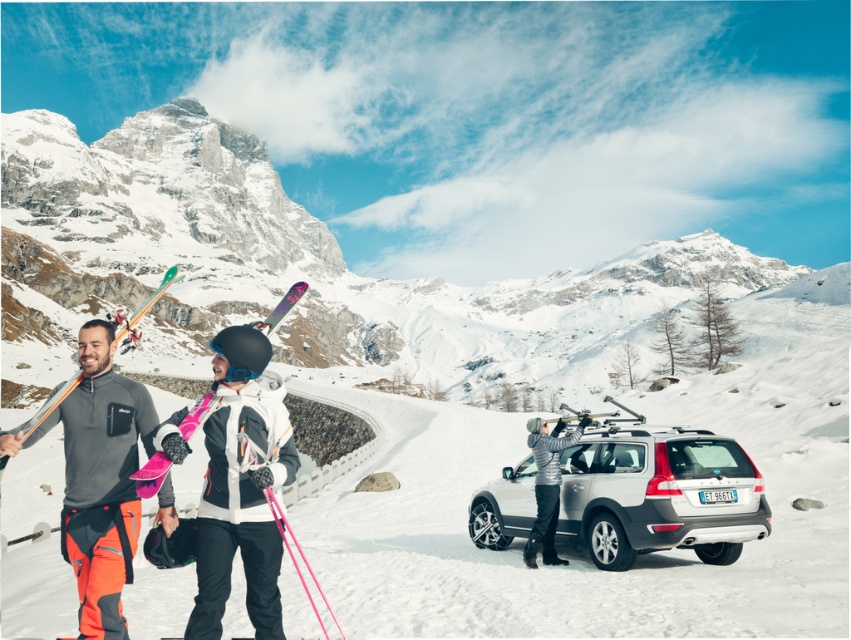
Question: Is snowy granite mountain at upper left to the left of matte pink snowboard at center from the viewer's perspective?

Choices:
 (A) yes
 (B) no

Answer: (B)

Question: Which object is positioned farthest from the snowy granite mountain at upper left?

Choices:
 (A) pink matte skis at center
 (B) white matte suv at center
 (C) silver metallic jacket at center
 (D) matte pink snowboard at center

Answer: (A)

Question: Among these points, which one is nearest to the camera?

Choices:
 (A) (278, 316)
 (B) (233, 490)

Answer: (B)

Question: Is snowy granite mountain at upper left to the right of matte pink snowboard at center from the viewer's perspective?

Choices:
 (A) no
 (B) yes

Answer: (B)

Question: Considering the real-world distances, which object is farthest from the silver metallic jacket at center?

Choices:
 (A) wooden skis at left
 (B) white matte suv at center

Answer: (A)

Question: Is snowy granite mountain at upper left smaller than orange ski pants at left?

Choices:
 (A) yes
 (B) no

Answer: (B)